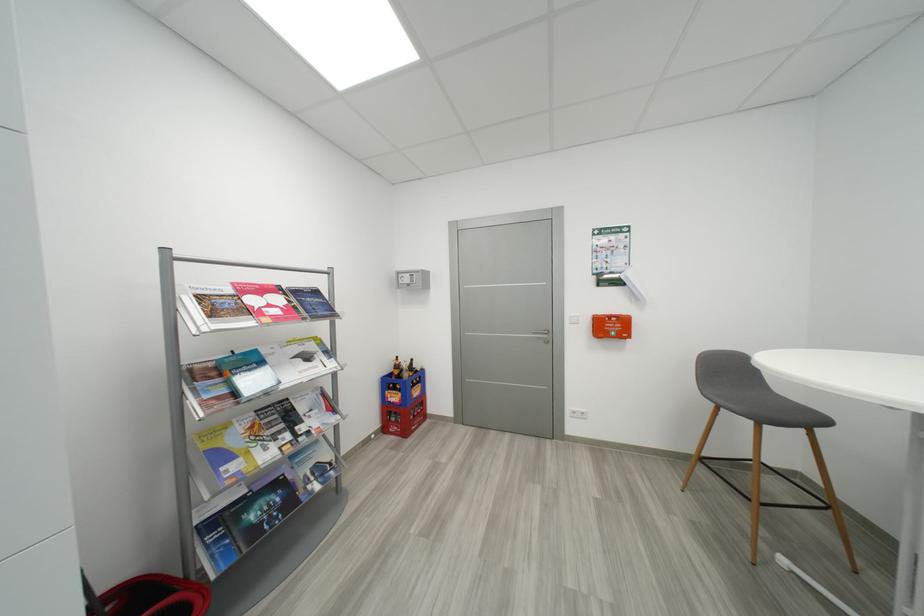
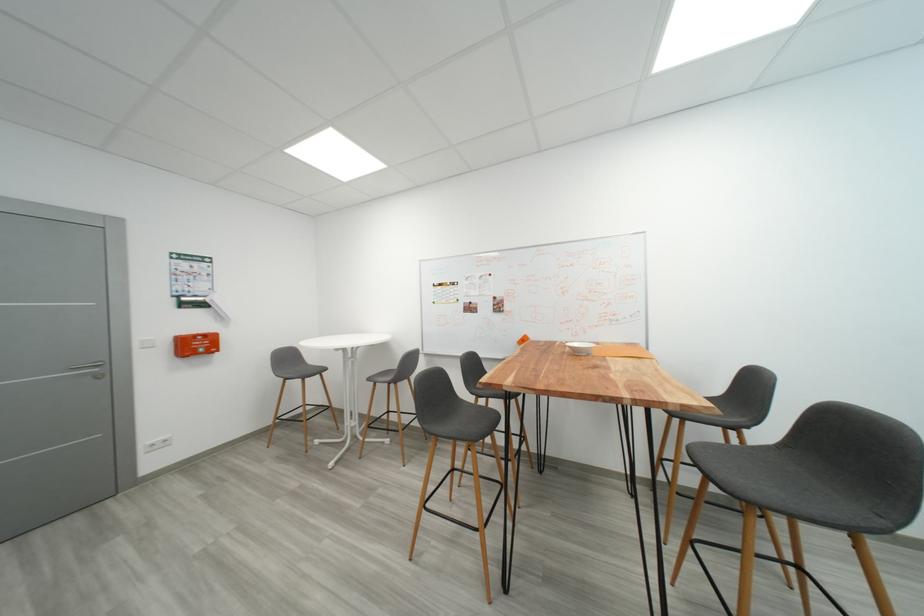
Find the pixel in the second image that matches [617,330] in the first image.

(203, 347)